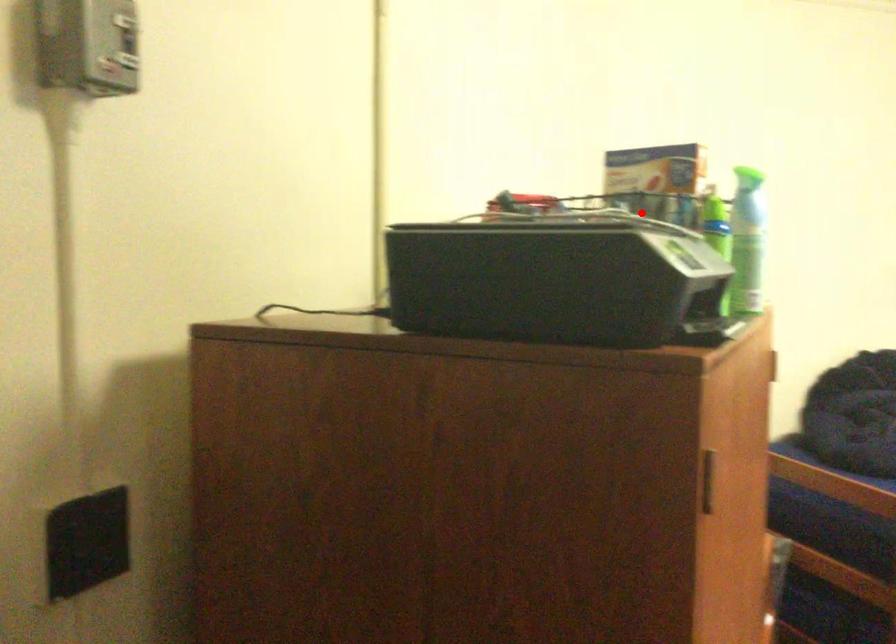
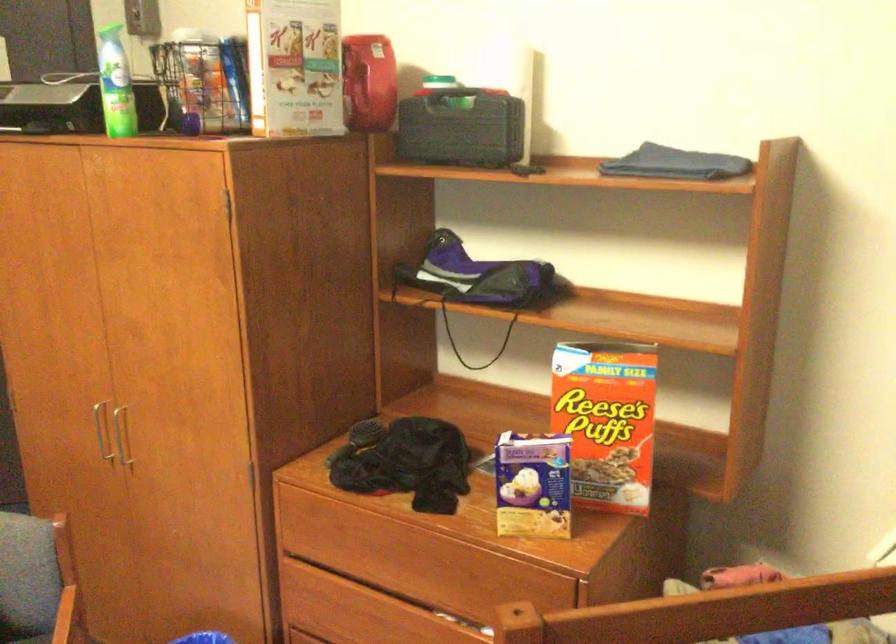
In the second image, find the point that corresponds to the highlighted location in the first image.

(295, 67)